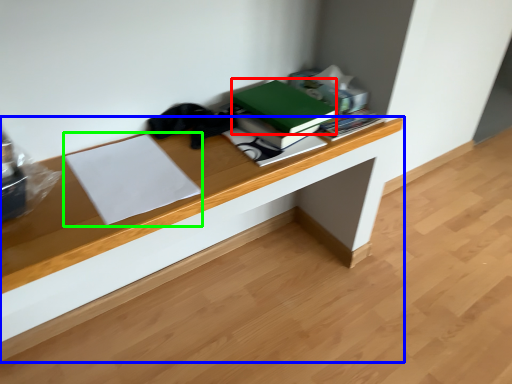
Question: Which object is positioned farthest from paperback book (highlighted by a red box)? Select from desk (highlighted by a blue box) and paperback book (highlighted by a green box).

Choices:
 (A) desk
 (B) paperback book

Answer: (B)